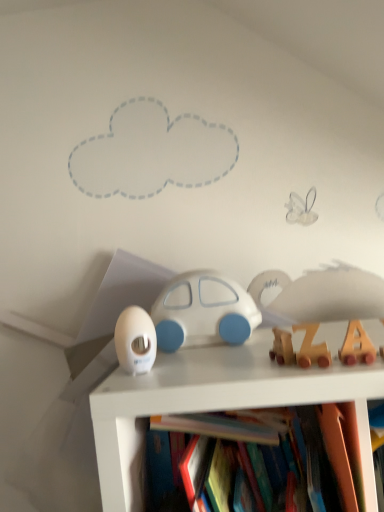
Question: Should I look upward or downward to see wooden train at right, the 2th toy positioned from the front?

Choices:
 (A) up
 (B) down

Answer: (B)

Question: Is the position of white glossy egg at center, placed as the third toy when sorted from front to back, less distant than that of wooden train at right, arranged as the third toy when viewed from the left?

Choices:
 (A) yes
 (B) no

Answer: (B)

Question: Does white glossy egg at center, placed as the third toy when sorted from front to back, have a lesser height compared to wooden train at right, arranged as the third toy when viewed from the left?

Choices:
 (A) yes
 (B) no

Answer: (B)

Question: Is white glossy egg at center, acting as the 4th toy starting from the right, aimed at wooden train at right, the 2th toy positioned from the front?

Choices:
 (A) no
 (B) yes

Answer: (A)

Question: Does white glossy egg at center, placed as the third toy when sorted from front to back, have a smaller size compared to wooden train at right, the 3th toy from the back?

Choices:
 (A) yes
 (B) no

Answer: (B)

Question: Is white glossy egg at center, the 1th toy positioned from the left, behind wooden train at right, the 3th toy from the back?

Choices:
 (A) yes
 (B) no

Answer: (A)

Question: Is white glossy egg at center, the 1th toy positioned from the left, positioned beyond the bounds of wooden train at right, the 3th toy from the back?

Choices:
 (A) yes
 (B) no

Answer: (A)

Question: Could you tell me if white glossy egg at center, acting as the 4th toy starting from the right, is facing white matte car at center, the first toy viewed from the back?

Choices:
 (A) no
 (B) yes

Answer: (A)

Question: From a real-world perspective, is white glossy egg at center, placed as the third toy when sorted from front to back, beneath white matte car at center, arranged as the 2th toy when viewed from the left?

Choices:
 (A) no
 (B) yes

Answer: (B)

Question: Does white glossy egg at center, the 1th toy positioned from the left, have a lesser height compared to white matte car at center, the first toy viewed from the back?

Choices:
 (A) no
 (B) yes

Answer: (B)

Question: Considering the relative sizes of white glossy egg at center, the 1th toy positioned from the left, and white matte car at center, arranged as the 2th toy when viewed from the left, in the image provided, is white glossy egg at center, the 1th toy positioned from the left, taller than white matte car at center, arranged as the 2th toy when viewed from the left,?

Choices:
 (A) no
 (B) yes

Answer: (A)

Question: Is white glossy egg at center, the 1th toy positioned from the left, wider than white matte car at center, arranged as the 2th toy when viewed from the left?

Choices:
 (A) yes
 (B) no

Answer: (B)

Question: Can you confirm if white glossy egg at center, arranged as the 2th toy when viewed from the back, is positioned to the left of white matte car at center, the first toy viewed from the back?

Choices:
 (A) yes
 (B) no

Answer: (A)

Question: Is white matte car at center, acting as the 3th toy starting from the right, next to wooden train at right, the 2th toy positioned from the front, and touching it?

Choices:
 (A) yes
 (B) no

Answer: (B)